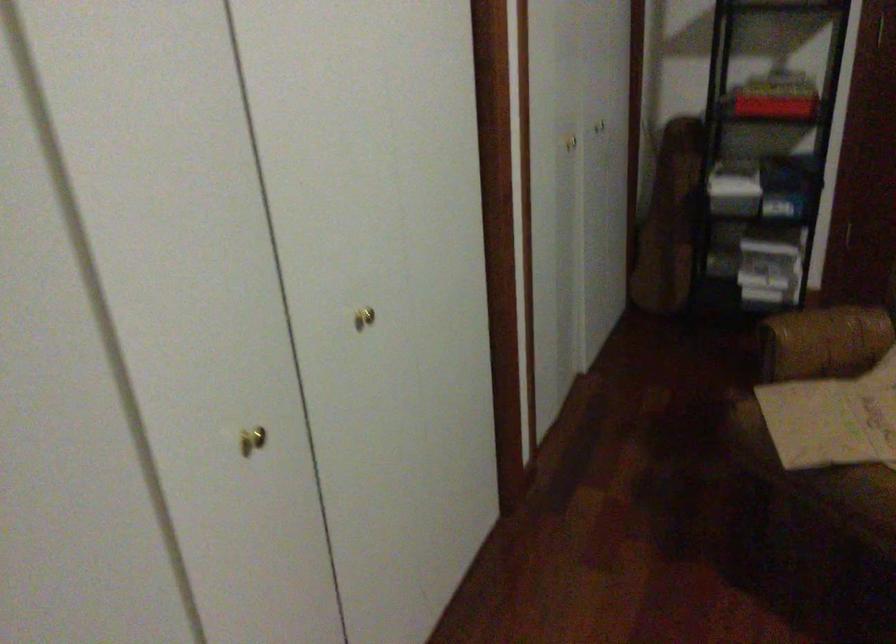
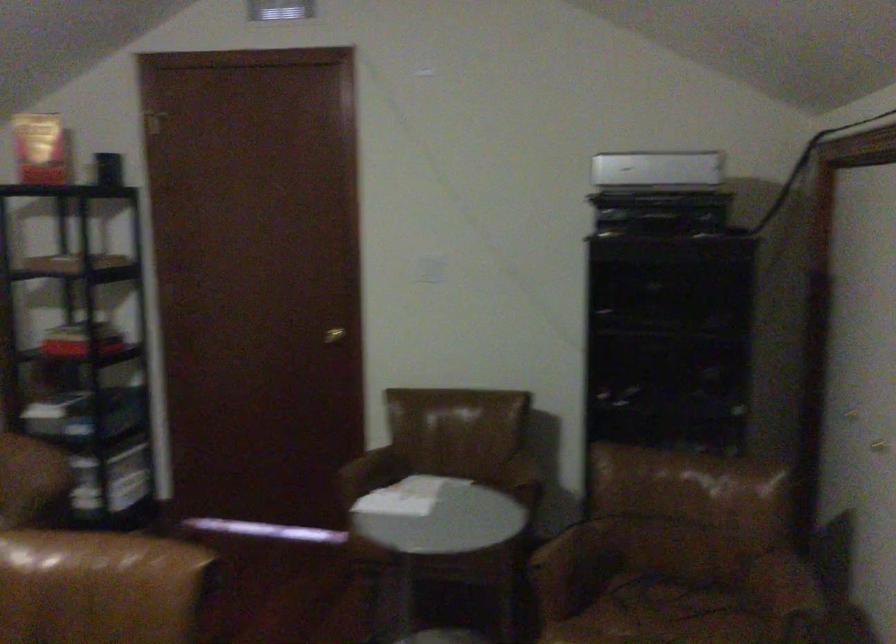
What movement of the cameraman would produce the second image?

The movement direction of the cameraman is right, backward.